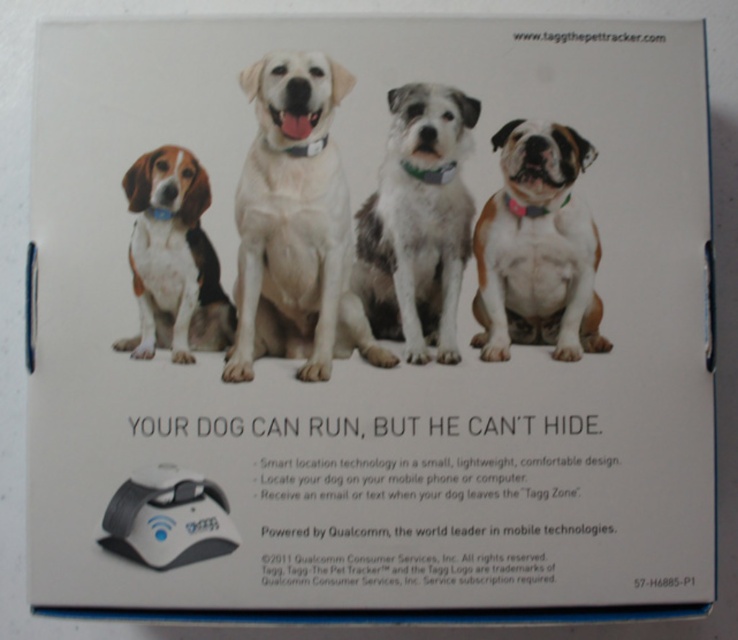
Who is lower down, pink fabric dog at right or white plastic mouse at bottom left?

white plastic mouse at bottom left

Is point (539, 180) less distant than point (207, 529)?

That is False.

Locate an element on the screen. pink fabric dog at right is located at coordinates (537, 248).

Does white fur dog at center appear over white plastic mouse at bottom left?

Yes.

Is white fur dog at center thinner than white plastic mouse at bottom left?

Yes, white fur dog at center is thinner than white plastic mouse at bottom left.

Describe the element at coordinates (417, 221) in the screenshot. Image resolution: width=738 pixels, height=640 pixels. I see `white fur dog at center` at that location.

I want to click on white fur dog at center, so click(x=417, y=221).

Describe the element at coordinates (294, 225) in the screenshot. Image resolution: width=738 pixels, height=640 pixels. I see `white matte dog at center` at that location.

Is white matte dog at center to the right of white fur dog at center from the viewer's perspective?

No, white matte dog at center is not to the right of white fur dog at center.

Describe the element at coordinates (294, 225) in the screenshot. The width and height of the screenshot is (738, 640). I see `white matte dog at center` at that location.

The image size is (738, 640). In order to click on white matte dog at center in this screenshot , I will do `click(294, 225)`.